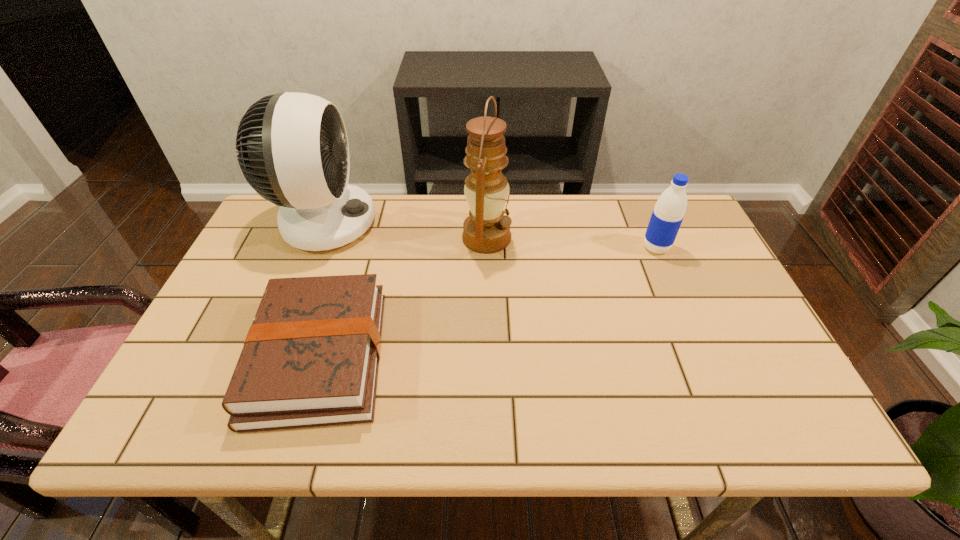
Where is `free space at the far edge`? The height and width of the screenshot is (540, 960). free space at the far edge is located at coordinates (453, 224).

You are a GUI agent. You are given a task and a screenshot of the screen. Output one action in this format:
    pyautogui.click(x=<x>, y=<y>)
    Task: Click on the vacant area at the near edge of the desktop
    This screenshot has width=960, height=540.
    Given the screenshot: What is the action you would take?
    pyautogui.click(x=721, y=405)

Where is `vacant space at the right edge of the desktop`? This screenshot has width=960, height=540. vacant space at the right edge of the desktop is located at coordinates (677, 257).

Locate an element on the screen. Image resolution: width=960 pixels, height=540 pixels. vacant space at the far right corner is located at coordinates (693, 241).

Where is `free space between the shortest object and the third object from left to right`? free space between the shortest object and the third object from left to right is located at coordinates (403, 297).

The height and width of the screenshot is (540, 960). I want to click on free space between the fan and the third object from left to right, so click(x=405, y=231).

Locate an element on the screen. This screenshot has width=960, height=540. vacant region between the fan and the third object from left to right is located at coordinates (405, 231).

Image resolution: width=960 pixels, height=540 pixels. Identify the location of free point between the shortest object and the rightmost object. (488, 302).

Where is `vacant area that lies between the nearest object and the water bottle`? vacant area that lies between the nearest object and the water bottle is located at coordinates (488, 302).

Identify the location of unoccupied position between the third tallest object and the shortest object. This screenshot has width=960, height=540. (488, 302).